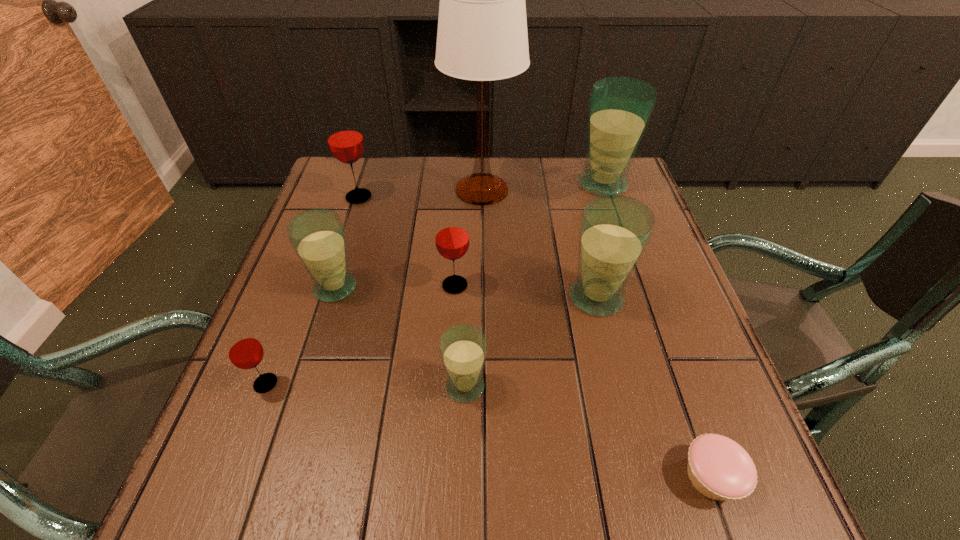
Identify the location of vacant space at the far edge of the desktop. (390, 174).

In the image, there is a desktop. Where is `vacant space at the near edge`? vacant space at the near edge is located at coordinates (610, 494).

Image resolution: width=960 pixels, height=540 pixels. In order to click on blank space at the left edge of the desktop in this screenshot , I will do `click(275, 322)`.

The image size is (960, 540). In the image, there is a desktop. In order to click on vacant space at the right edge in this screenshot , I will do `click(705, 352)`.

Identify the location of vacant space at the far left corner of the desktop. This screenshot has height=540, width=960. pos(378,186).

I want to click on vacant space at the far right corner of the desktop, so click(629, 194).

Find the location of a particular element. free point between the farthest red glass and the pink cupcake is located at coordinates (535, 337).

At what (x,y) coordinates should I click in order to perform the action: click on free area in between the nearest red glass and the cupcake. Please return your answer as a coordinate pair (x, y). This screenshot has width=960, height=540. Looking at the image, I should click on (489, 430).

Find the location of a particular element. vacant area that lies between the cupcake and the leftmost blue glass is located at coordinates (523, 382).

Where is `free space between the third smallest blue glass and the smallest blue glass`? This screenshot has width=960, height=540. free space between the third smallest blue glass and the smallest blue glass is located at coordinates (531, 342).